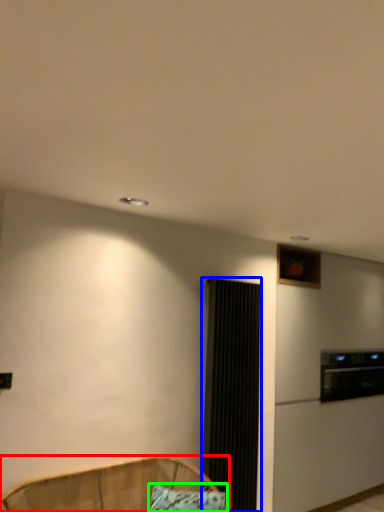
Question: Which object is positioned closest to furniture (highlighted by a red box)? Select from screen door (highlighted by a blue box) and pillow (highlighted by a green box).

Choices:
 (A) screen door
 (B) pillow

Answer: (B)